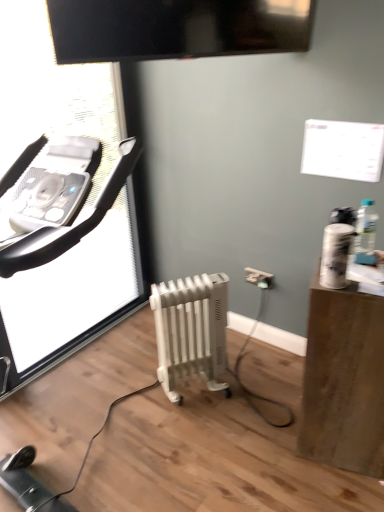
Question: Based on their sizes in the image, would you say transparent plastic screen door at left is bigger or smaller than white plastic electric outlet at lower center?

Choices:
 (A) big
 (B) small

Answer: (A)

Question: Is transparent plastic screen door at left spatially inside white plastic electric outlet at lower center, or outside of it?

Choices:
 (A) inside
 (B) outside

Answer: (B)

Question: Which is nearer to the brown wood side table at right?

Choices:
 (A) white plastic radiator at center
 (B) clear plastic bottle at right
 (C) glossy black tv at upper center
 (D) transparent plastic screen door at left
 (E) white plastic electric outlet at lower center

Answer: (B)

Question: Which is nearer to the clear plastic bottle at right?

Choices:
 (A) white plastic radiator at center
 (B) white plastic electric outlet at lower center
 (C) transparent plastic screen door at left
 (D) brown wood side table at right
 (E) glossy black tv at upper center

Answer: (D)